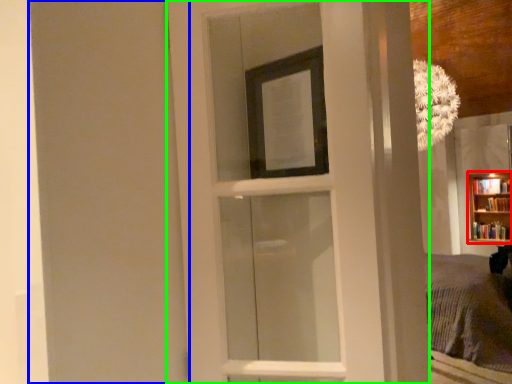
Question: Which object is the closest to the bookcase (highlighted by a red box)? Choose among these: screen door (highlighted by a blue box) or door (highlighted by a green box).

Choices:
 (A) screen door
 (B) door

Answer: (B)